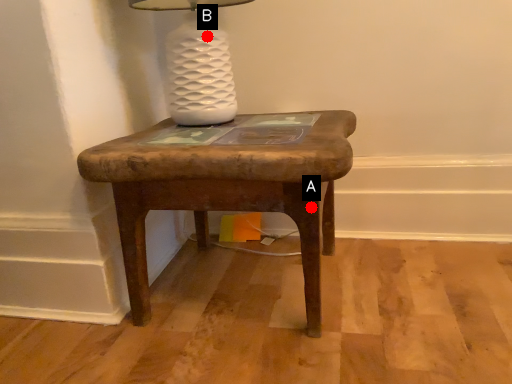
Question: Two points are circled on the image, labeled by A and B beside each circle. Which point is farther to the camera?

Choices:
 (A) A is further
 (B) B is further

Answer: (B)